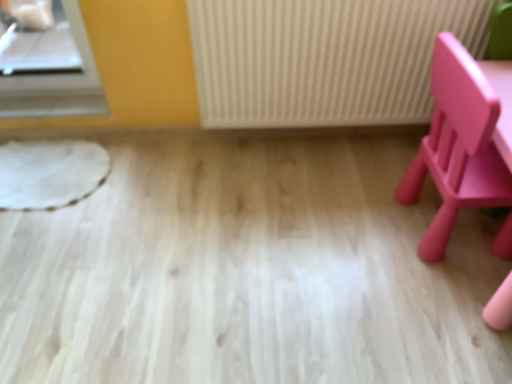
The height and width of the screenshot is (384, 512). I want to click on matte pink chair at right, so click(457, 145).

Looking at this image, what is the approximate height of matte pink chair at right?

67.03 centimeters.

This screenshot has height=384, width=512. Describe the element at coordinates (457, 145) in the screenshot. I see `matte pink chair at right` at that location.

What do you see at coordinates (324, 59) in the screenshot? Image resolution: width=512 pixels, height=384 pixels. I see `white textured radiator at center` at bounding box center [324, 59].

This screenshot has width=512, height=384. Find the location of `white textured radiator at center`. white textured radiator at center is located at coordinates (324, 59).

Find the location of a particular element. matte pink chair at right is located at coordinates (457, 145).

Which is more to the right, white textured radiator at center or matte pink chair at right?

matte pink chair at right.

Is white textured radiator at center in front of or behind matte pink chair at right in the image?

white textured radiator at center is positioned farther from the viewer than matte pink chair at right.

Considering the positions of point (249, 40) and point (488, 180), is point (249, 40) closer or farther from the camera than point (488, 180)?

Point (249, 40).

Based on the photo, from the image's perspective, which one is positioned higher, white textured radiator at center or matte pink chair at right?

white textured radiator at center, from the image's perspective.

Based on the photo, from a real-world perspective, is white textured radiator at center physically below matte pink chair at right?

No, from a real-world perspective, white textured radiator at center is not below matte pink chair at right.

Between white textured radiator at center and matte pink chair at right, which one has larger width?

matte pink chair at right is wider.

Can you confirm if white textured radiator at center is taller than matte pink chair at right?

No, white textured radiator at center is not taller than matte pink chair at right.

Which of these two, white textured radiator at center or matte pink chair at right, is smaller?

Smaller between the two is white textured radiator at center.

Do you think white textured radiator at center is within matte pink chair at right, or outside of it?

white textured radiator at center is not enclosed by matte pink chair at right.

In the scene shown: Does white textured radiator at center touch matte pink chair at right?

white textured radiator at center and matte pink chair at right are not in contact.

Is white textured radiator at center aimed at matte pink chair at right?

Yes, white textured radiator at center is oriented towards matte pink chair at right.

I want to click on chair below the white textured radiator at center (from the image's perspective), so click(x=457, y=145).

Can you confirm if matte pink chair at right is positioned to the right of white textured radiator at center?

Correct, you'll find matte pink chair at right to the right of white textured radiator at center.

Which is in front, matte pink chair at right or white textured radiator at center?

matte pink chair at right is closer to the camera.

Is point (470, 80) farther from camera compared to point (390, 108)?

No, (470, 80) is closer to viewer.

Based on the photo, from the image's perspective, is matte pink chair at right beneath white textured radiator at center?

Yes, from the image's perspective, matte pink chair at right is beneath white textured radiator at center.

From a real-world perspective, is matte pink chair at right beneath white textured radiator at center?

Yes.

Is matte pink chair at right wider than white textured radiator at center?

Correct, the width of matte pink chair at right exceeds that of white textured radiator at center.

Is matte pink chair at right taller or shorter than white textured radiator at center?

In the image, matte pink chair at right appears to be taller than white textured radiator at center.

Considering the sizes of objects matte pink chair at right and white textured radiator at center in the image provided, who is bigger, matte pink chair at right or white textured radiator at center?

With larger size is matte pink chair at right.

Is matte pink chair at right outside of white textured radiator at center?

That's correct, matte pink chair at right is outside of white textured radiator at center.

Is matte pink chair at right positioned far away from white textured radiator at center?

No, there isn't a large distance between matte pink chair at right and white textured radiator at center.

Could you tell me if matte pink chair at right is turned towards white textured radiator at center?

No, matte pink chair at right is not turned towards white textured radiator at center.

Measure the distance between matte pink chair at right and white textured radiator at center.

A distance of 18.63 inches exists between matte pink chair at right and white textured radiator at center.

Find the location of a particular element. This screenshot has height=384, width=512. radiator located on the left of matte pink chair at right is located at coordinates (324, 59).

This screenshot has height=384, width=512. I want to click on radiator above the matte pink chair at right (from a real-world perspective), so click(x=324, y=59).

Where is `radiator that is on the left side of matte pink chair at right`? The height and width of the screenshot is (384, 512). radiator that is on the left side of matte pink chair at right is located at coordinates (324, 59).